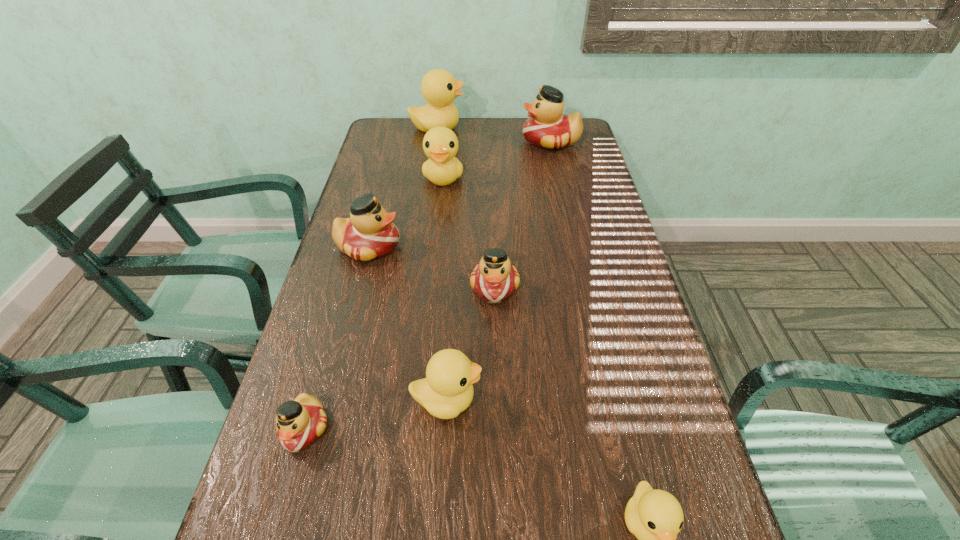
Where is `vacant space that's between the second red duck from right to left and the biggest red duck`? The image size is (960, 540). vacant space that's between the second red duck from right to left and the biggest red duck is located at coordinates (523, 214).

What are the coordinates of `vacant region between the second farthest red duck and the biggest yellow duck` in the screenshot? It's located at (403, 187).

Identify the location of free spot between the third farthest object and the rightmost red duck. This screenshot has height=540, width=960. (497, 159).

Where is `empty space that is in between the third nearest red duck and the nearest red duck`? This screenshot has height=540, width=960. empty space that is in between the third nearest red duck and the nearest red duck is located at coordinates point(337,338).

Point out which object is positioned as the fifth nearest to the smallest yellow duck. Please provide its 2D coordinates. Your answer should be formatted as a tuple, i.e. [(x, y)], where the tuple contains the x and y coordinates of a point satisfying the conditions above.

[(440, 144)]

This screenshot has height=540, width=960. Find the location of `the closest object relative to the farthest red duck`. the closest object relative to the farthest red duck is located at coordinates (439, 88).

Where is `duck that is the fourth closest to the nearest duck`? The height and width of the screenshot is (540, 960). duck that is the fourth closest to the nearest duck is located at coordinates (369, 233).

Where is `duck that is the second nearest to the smallest red duck`? duck that is the second nearest to the smallest red duck is located at coordinates (494, 279).

Point out which yellow duck is positioned as the second nearest to the biggest yellow duck. Please provide its 2D coordinates. Your answer should be formatted as a tuple, i.e. [(x, y)], where the tuple contains the x and y coordinates of a point satisfying the conditions above.

[(447, 390)]

Locate which yellow duck ranks in proximity to the smallest red duck. Please provide its 2D coordinates. Your answer should be formatted as a tuple, i.e. [(x, y)], where the tuple contains the x and y coordinates of a point satisfying the conditions above.

[(447, 390)]